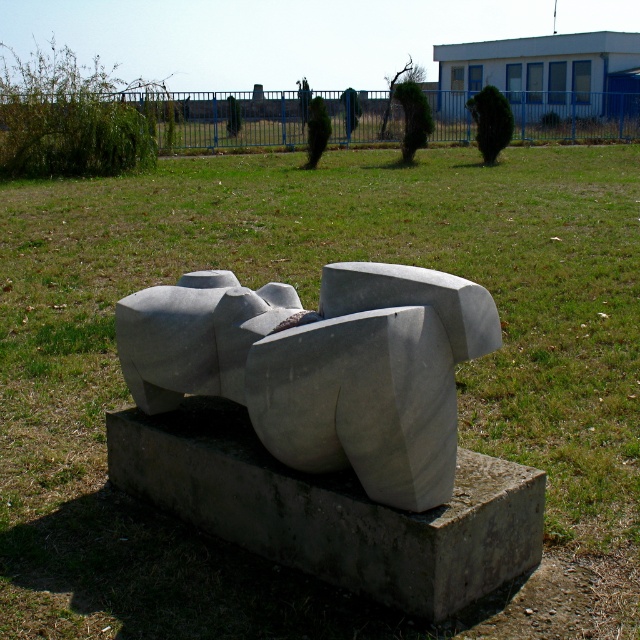
Question: Which object is closer to the camera taking this photo?

Choices:
 (A) gray stone sculpture at center
 (B) gray concrete sculpture at center

Answer: (A)

Question: Does gray stone sculpture at center have a smaller size compared to gray concrete sculpture at center?

Choices:
 (A) yes
 (B) no

Answer: (B)

Question: Does gray stone sculpture at center appear over gray concrete sculpture at center?

Choices:
 (A) yes
 (B) no

Answer: (A)

Question: Is gray stone sculpture at center to the left of gray concrete sculpture at center from the viewer's perspective?

Choices:
 (A) no
 (B) yes

Answer: (A)

Question: Which of the following is the farthest from the observer?

Choices:
 (A) gray concrete sculpture at center
 (B) gray stone sculpture at center

Answer: (A)

Question: Which of the following is the closest to the observer?

Choices:
 (A) click(492, 582)
 (B) click(202, 340)

Answer: (A)